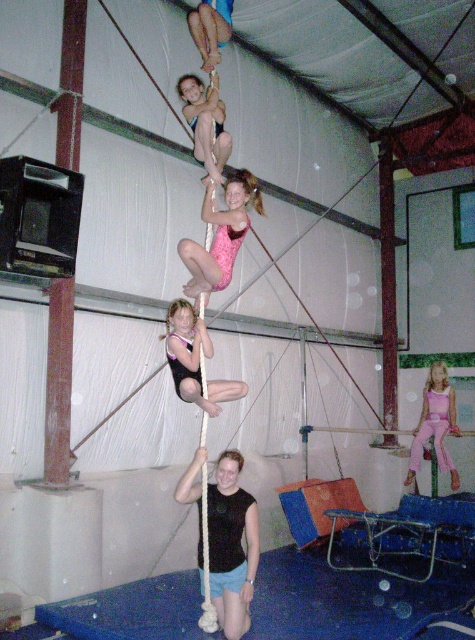
You are standing at the entrance of the gymnasium and see the point marked as point (135, 132). What object is located at that point?

The white fabric pole at upper center is located at point (135, 132).

You are a safety inspector checking the gym equipment. You notice the white fabric pole at upper center and the pink fabric pole at center. Which pole has a larger diameter?

The pink fabric pole at center has a larger diameter than the white fabric pole at upper center.